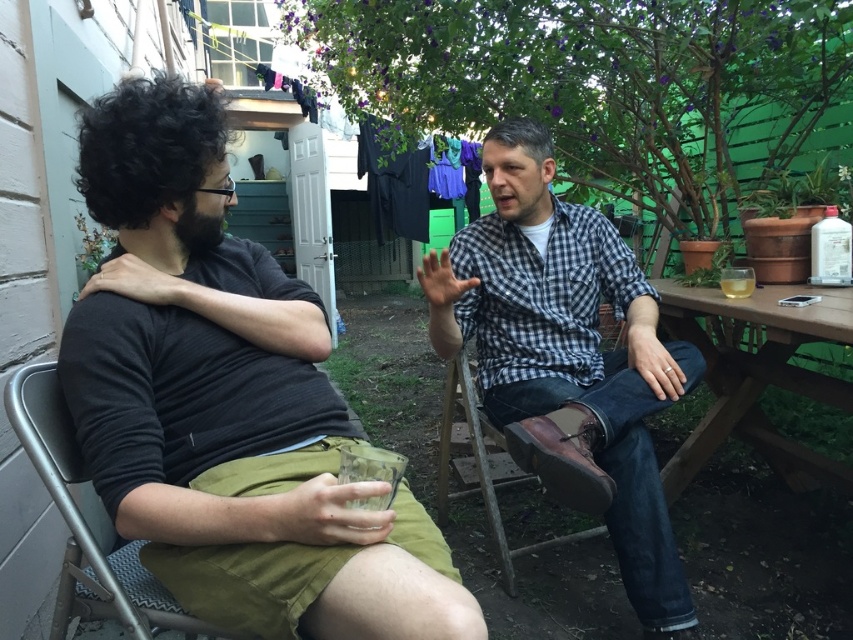
Question: Which is farther from the wooden picnic table at right?

Choices:
 (A) brown leather chair at center
 (B) dark gray t-shirt at left

Answer: (B)

Question: Can you confirm if checkered fabric shirt at center is positioned above metallic gray chair at left?

Choices:
 (A) yes
 (B) no

Answer: (A)

Question: Can you confirm if metallic gray chair at left is positioned to the right of brown leather chair at center?

Choices:
 (A) no
 (B) yes

Answer: (A)

Question: Does dark gray t-shirt at left have a larger size compared to brown leather chair at center?

Choices:
 (A) yes
 (B) no

Answer: (B)

Question: Which of the following is the farthest from the observer?

Choices:
 (A) (843, 316)
 (B) (285, 387)

Answer: (A)

Question: Considering the real-world distances, which object is farthest from the metallic gray chair at left?

Choices:
 (A) checkered fabric shirt at center
 (B) wooden picnic table at right
 (C) dark gray t-shirt at left

Answer: (B)